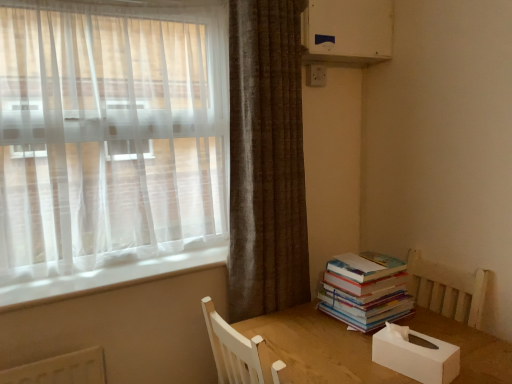
Question: Do you think white matte tissue box at lower right is within sheer white curtain at left, the 1th curtain in the left-to-right sequence, or outside of it?

Choices:
 (A) outside
 (B) inside

Answer: (A)

Question: Is white matte tissue box at lower right in front of or behind sheer white curtain at left, the 1th curtain in the left-to-right sequence, in the image?

Choices:
 (A) front
 (B) behind

Answer: (A)

Question: Which object is the closest to the white matte tissue box at lower right?

Choices:
 (A) white plastic window sill at lower left
 (B) brown textured curtain at upper right, placed as the second curtain when sorted from left to right
 (C) sheer white curtain at left, the 1th curtain in the left-to-right sequence
 (D) white plastic air conditioning unit at upper right
 (E) white plastic electric outlet at upper center

Answer: (B)

Question: Which object is positioned farthest from the white plastic air conditioning unit at upper right?

Choices:
 (A) white plastic window sill at lower left
 (B) white plastic electric outlet at upper center
 (C) white matte tissue box at lower right
 (D) hardcover books at right
 (E) sheer white curtain at left, the 1th curtain in the left-to-right sequence

Answer: (C)